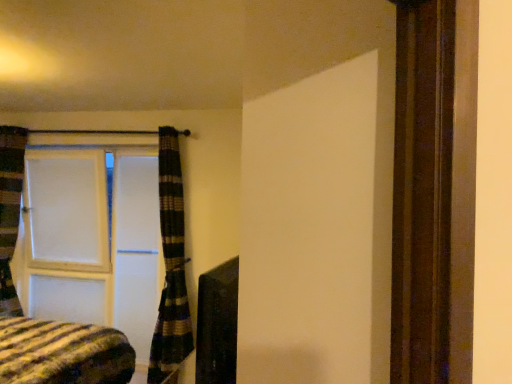
Find the location of a particular element. Image resolution: width=512 pixels, height=384 pixels. striped fabric bed at lower left is located at coordinates (46, 321).

The width and height of the screenshot is (512, 384). What do you see at coordinates (46, 321) in the screenshot?
I see `striped fabric bed at lower left` at bounding box center [46, 321].

Locate an element on the screen. This screenshot has width=512, height=384. striped fabric bed at lower left is located at coordinates (46, 321).